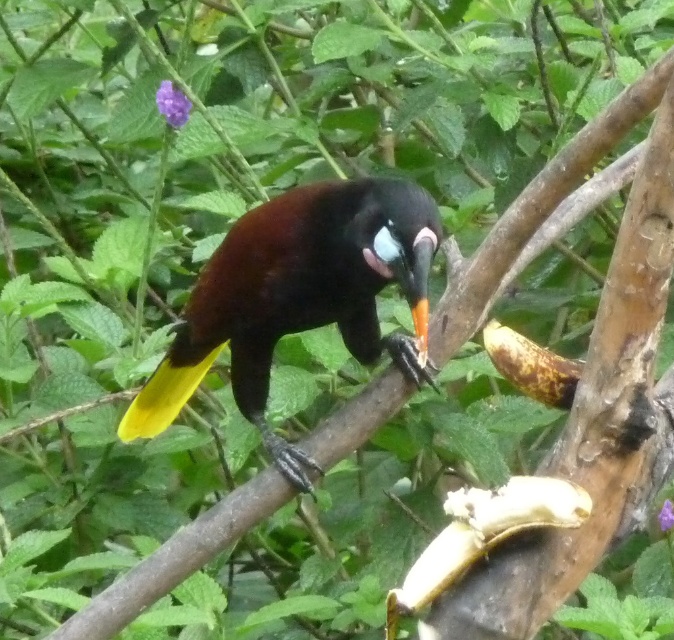
Who is positioned more to the right, shiny black bird at center or yellow matte banana at lower right?

Positioned to the right is yellow matte banana at lower right.

Describe the element at coordinates (299, 298) in the screenshot. I see `shiny black bird at center` at that location.

Where is `shiny black bird at center`? The height and width of the screenshot is (640, 674). shiny black bird at center is located at coordinates (299, 298).

Can you confirm if shiny black bird at center is positioned to the left of yellowish-brown textured banana at right?

Yes, shiny black bird at center is to the left of yellowish-brown textured banana at right.

Does point (235, 333) lie in front of point (495, 356)?

No.

I want to click on shiny black bird at center, so click(x=299, y=298).

Is yellow matte banana at lower right to the right of yellowish-brown textured banana at right from the viewer's perspective?

No, yellow matte banana at lower right is not to the right of yellowish-brown textured banana at right.

The width and height of the screenshot is (674, 640). Describe the element at coordinates (483, 532) in the screenshot. I see `yellow matte banana at lower right` at that location.

Identify the location of yellow matte banana at lower right. (483, 532).